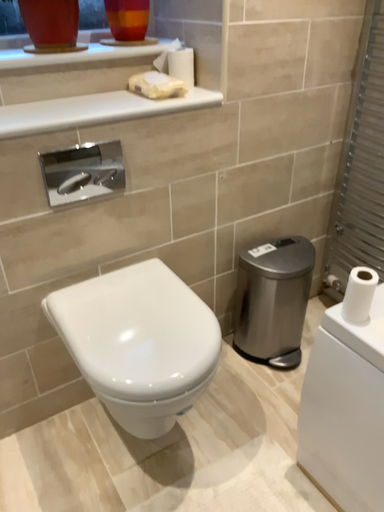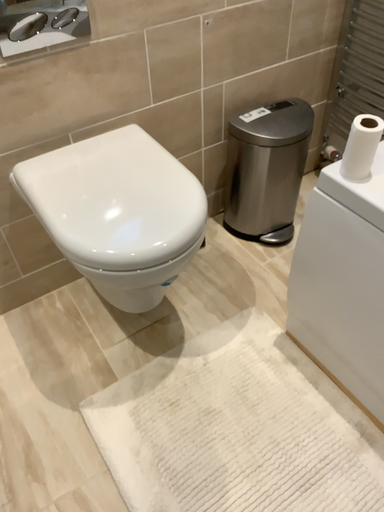
Question: Which way did the camera rotate in the video?

Choices:
 (A) rotated downward
 (B) rotated upward

Answer: (A)